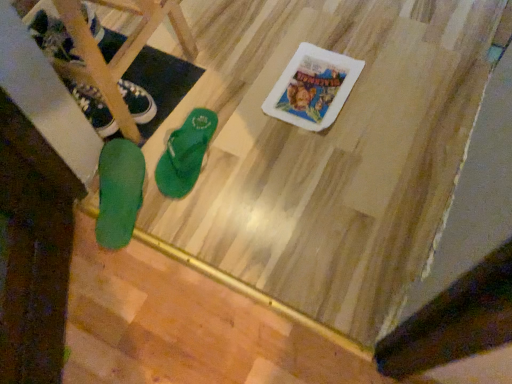
Question: Considering the positions of green rubber flip-flop at lower left, the second footwear when ordered from right to left, and green rubber flip-flop at lower left, the 3th footwear when ordered from right to left, in the image, is green rubber flip-flop at lower left, the second footwear when ordered from right to left, wider or thinner than green rubber flip-flop at lower left, the 3th footwear when ordered from right to left,?

Choices:
 (A) wide
 (B) thin

Answer: (A)

Question: Considering the positions of green rubber flip-flop at lower left, the second footwear when ordered from right to left, and green rubber flip-flop at lower left, which appears as the first footwear when viewed from the left, in the image, is green rubber flip-flop at lower left, the second footwear when ordered from right to left, taller or shorter than green rubber flip-flop at lower left, which appears as the first footwear when viewed from the left,?

Choices:
 (A) short
 (B) tall

Answer: (B)

Question: Which object is positioned closest to the green rubber flip-flop at center, the third footwear from the left?

Choices:
 (A) green rubber flip-flop at lower left, which appears as the first footwear when viewed from the left
 (B) green rubber flip-flop at lower left, the 2th footwear positioned from the left

Answer: (B)

Question: Estimate the real-world distances between objects in this image. Which object is closer to the green rubber flip-flop at lower left, the 3th footwear when ordered from right to left?

Choices:
 (A) green rubber flip-flop at center, marked as the first footwear in a right-to-left arrangement
 (B) green rubber flip-flop at lower left, the 2th footwear positioned from the left

Answer: (B)